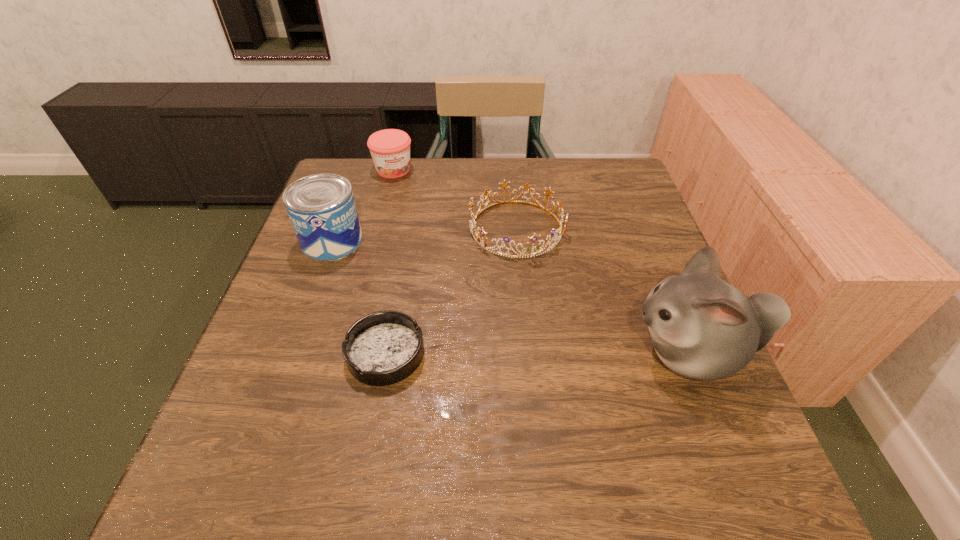
What are the coordinates of `the shortest object` in the screenshot? It's located at (382, 348).

The height and width of the screenshot is (540, 960). What are the coordinates of `the rightmost object` in the screenshot? It's located at (701, 327).

I want to click on the tallest object, so click(701, 327).

Find the location of a particular element. the fourth tallest object is located at coordinates (472, 222).

Find the location of a particular element. the fourth object from left to right is located at coordinates (472, 222).

You are a GUI agent. You are given a task and a screenshot of the screen. Output one action in this format:
    pyautogui.click(x=<x>, y=<y>)
    Task: Click on the second tallest object
    This screenshot has width=960, height=540.
    Given the screenshot: What is the action you would take?
    pyautogui.click(x=321, y=207)

Image resolution: width=960 pixels, height=540 pixels. Identify the location of jam. (390, 149).

Where is `the third tallest object`? The width and height of the screenshot is (960, 540). the third tallest object is located at coordinates (390, 149).

Find the location of a particular element. vacant space situated 0.200m on the right of the shortest object is located at coordinates (527, 354).

The width and height of the screenshot is (960, 540). In order to click on blank space located on the face of the rightmost object in this screenshot , I will do `click(560, 353)`.